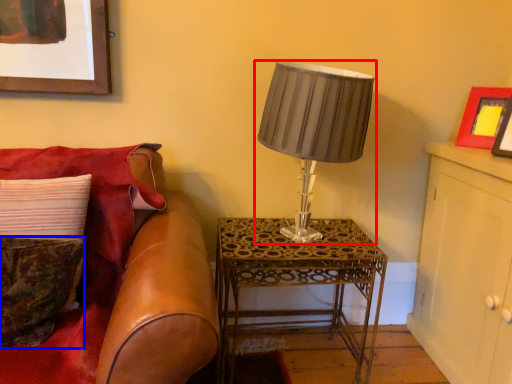
Question: Which object is closer to the camera taking this photo, lamp (highlighted by a red box) or pillow (highlighted by a blue box)?

Choices:
 (A) lamp
 (B) pillow

Answer: (B)